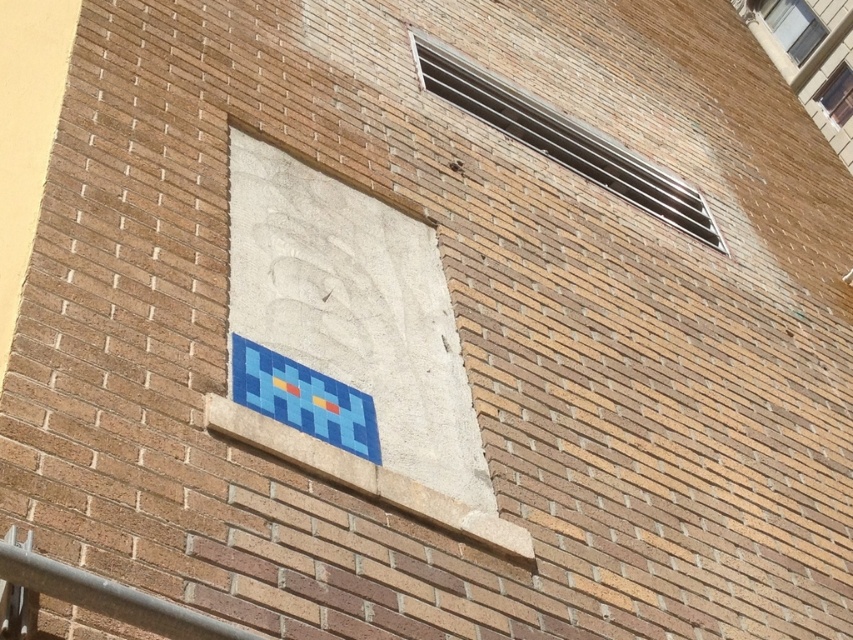
Looking at this image, who is taller, clear glass window at upper right or transparent glass window at upper right?

Standing taller between the two is clear glass window at upper right.

You are a GUI agent. You are given a task and a screenshot of the screen. Output one action in this format:
    pyautogui.click(x=<x>, y=<y>)
    Task: Click on the clear glass window at upper right
    The width and height of the screenshot is (853, 640).
    Given the screenshot: What is the action you would take?
    pyautogui.click(x=792, y=26)

Is metallic silver vent at upper right shorter than metallic gray rail at lower left?

Incorrect, metallic silver vent at upper right's height does not fall short of metallic gray rail at lower left's.

Between point (515, 140) and point (79, 602), which one is positioned in front?

Point (79, 602)

Is point (460, 97) positioned in front of point (53, 563)?

That is False.

Where is `metallic silver vent at upper right`? metallic silver vent at upper right is located at coordinates (561, 140).

Between point (460, 76) and point (824, 33), which one is positioned in front?

Point (460, 76) is more forward.

Is metallic silver vent at upper right smaller than clear glass window at upper right?

Actually, metallic silver vent at upper right might be larger than clear glass window at upper right.

You are a GUI agent. You are given a task and a screenshot of the screen. Output one action in this format:
    pyautogui.click(x=<x>, y=<y>)
    Task: Click on the metallic silver vent at upper right
    The image size is (853, 640).
    Given the screenshot: What is the action you would take?
    pyautogui.click(x=561, y=140)

The width and height of the screenshot is (853, 640). Identify the location of metallic silver vent at upper right. (561, 140).